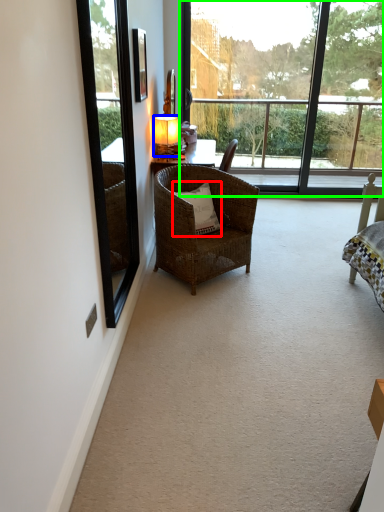
Question: Which object is the closest to the pillow (highlighted by a red box)? Choose among these: lamp (highlighted by a blue box) or window (highlighted by a green box).

Choices:
 (A) lamp
 (B) window

Answer: (A)